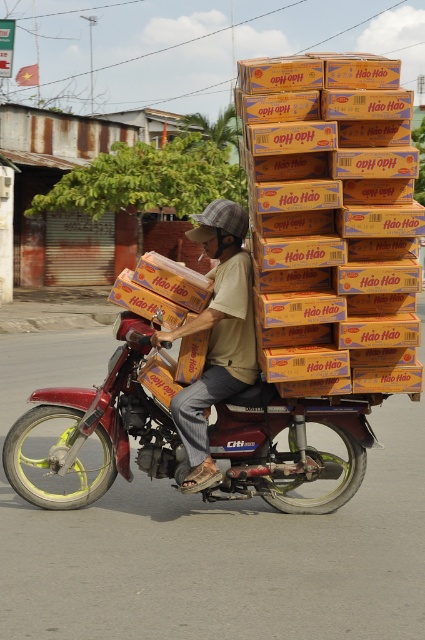
Question: Which of the following is the farthest from the observer?

Choices:
 (A) metallic red motorcycle at center
 (B) brown cotton shirt at center

Answer: (A)

Question: From the image, what is the correct spatial relationship of metallic red motorcycle at center in relation to brown cotton shirt at center?

Choices:
 (A) right
 (B) left

Answer: (B)

Question: Which point is closer to the camera?

Choices:
 (A) brown cotton shirt at center
 (B) metallic red motorcycle at center

Answer: (A)

Question: Does metallic red motorcycle at center appear on the left side of brown cotton shirt at center?

Choices:
 (A) no
 (B) yes

Answer: (B)

Question: Which point is closer to the camera taking this photo?

Choices:
 (A) (223, 381)
 (B) (232, 488)

Answer: (A)

Question: Can you confirm if metallic red motorcycle at center is wider than brown cotton shirt at center?

Choices:
 (A) yes
 (B) no

Answer: (A)